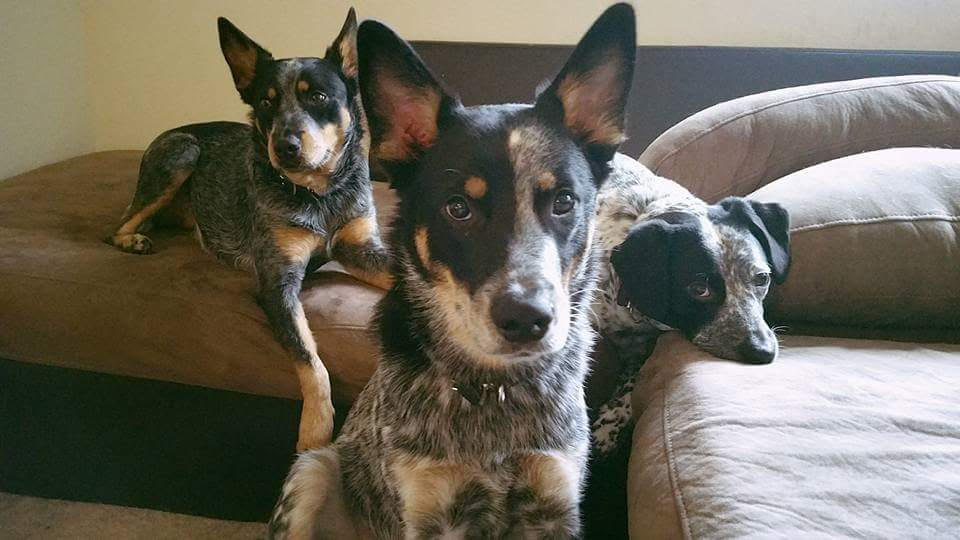
What are the coordinates of `black couch base` in the screenshot? It's located at 110,415.